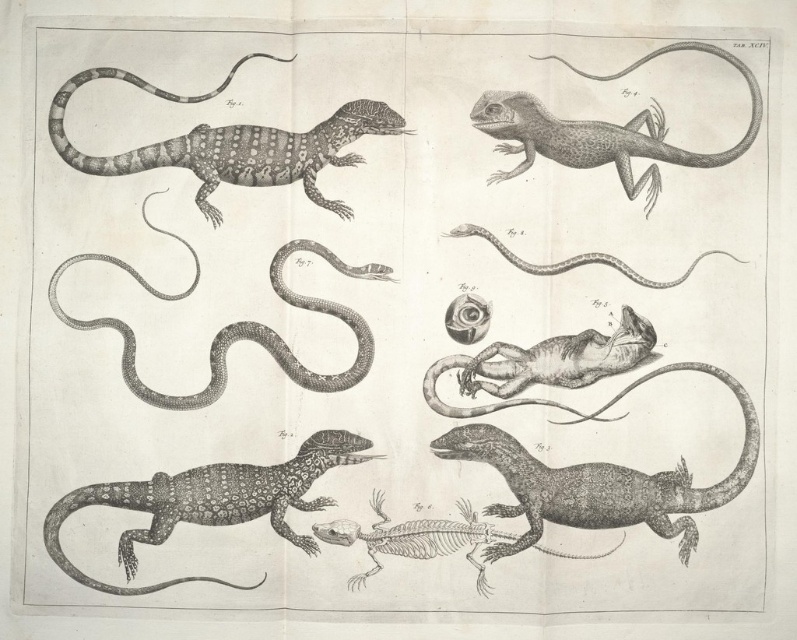
Between smooth gray lizard at upper right and smooth gray snake at upper center, which one is positioned lower?

smooth gray snake at upper center is lower down.

Is smooth gray lizard at upper right bigger than smooth gray snake at upper center?

Indeed, smooth gray lizard at upper right has a larger size compared to smooth gray snake at upper center.

Describe the element at coordinates (603, 131) in the screenshot. I see `smooth gray lizard at upper right` at that location.

Find the location of a particular element. smooth gray lizard at upper right is located at coordinates (603, 131).

Which is in front, point (662, 508) or point (525, 120)?

Point (662, 508) is more forward.

Looking at this image, is smooth gray lizard at lower right wider than smooth gray lizard at upper right?

Indeed, smooth gray lizard at lower right has a greater width compared to smooth gray lizard at upper right.

Locate an element on the screen. smooth gray lizard at lower right is located at coordinates (601, 480).

Locate an element on the screen. Image resolution: width=797 pixels, height=640 pixels. smooth gray lizard at lower right is located at coordinates (601, 480).

Can you confirm if patterned black lizard at lower left is thinner than smooth gray snake at center?

Yes, patterned black lizard at lower left is thinner than smooth gray snake at center.

At what (x,y) coordinates should I click in order to perform the action: click on patterned black lizard at lower left. Please return your answer as a coordinate pair (x, y). Looking at the image, I should click on (207, 502).

This screenshot has width=797, height=640. Identify the location of patterned black lizard at lower left. (207, 502).